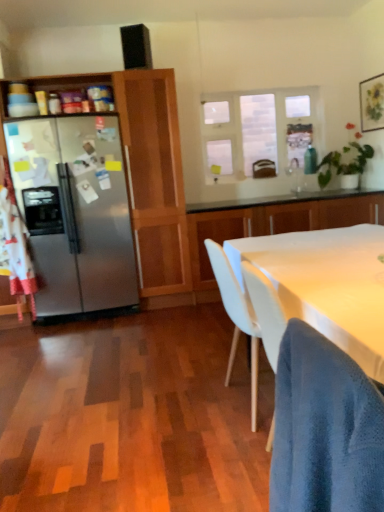
Describe the element at coordinates (274, 221) in the screenshot. This screenshot has width=384, height=512. I see `white glossy cabinet at center, positioned as the second cabinetry in left-to-right order` at that location.

The width and height of the screenshot is (384, 512). Describe the element at coordinates (136, 47) in the screenshot. I see `black matte speaker at upper center` at that location.

Based on the photo, measure the distance between satin silver refrigerator at left, marked as the 2th cabinetry in a right-to-left arrangement, and camera.

satin silver refrigerator at left, marked as the 2th cabinetry in a right-to-left arrangement, and camera are 3.49 meters apart from each other.

The width and height of the screenshot is (384, 512). What are the coordinates of `satin silver refrigerator at left, positioned as the 1th cabinetry in left-to-right order` in the screenshot? It's located at [148, 172].

What do you see at coordinates (325, 429) in the screenshot?
I see `blue textured fabric chair at lower right` at bounding box center [325, 429].

Describe the element at coordinates (344, 164) in the screenshot. I see `green leafy plant at upper right` at that location.

I want to click on white glossy cabinet at center, positioned as the second cabinetry in left-to-right order, so click(x=274, y=221).

How many degrees apart are the facing directions of blue textured fabric chair at lower right and green leafy plant at upper right?

The angular difference between blue textured fabric chair at lower right and green leafy plant at upper right is 88.8 degrees.

How much distance is there between blue textured fabric chair at lower right and green leafy plant at upper right?

The distance of blue textured fabric chair at lower right from green leafy plant at upper right is 13.07 feet.

Does blue textured fabric chair at lower right appear on the right side of green leafy plant at upper right?

In fact, blue textured fabric chair at lower right is to the left of green leafy plant at upper right.

Looking at this image, is blue textured fabric chair at lower right further to camera compared to green leafy plant at upper right?

No.

Based on the photo, is clear glass window at upper center further to camera compared to green leafy plant at upper right?

Yes, clear glass window at upper center is further from the camera.

From a real-world perspective, which is physically below, clear glass window at upper center or green leafy plant at upper right?

green leafy plant at upper right is physically lower.

From their relative heights in the image, would you say clear glass window at upper center is taller or shorter than green leafy plant at upper right?

Considering their sizes, clear glass window at upper center has more height than green leafy plant at upper right.

Which object is wider, white glossy cabinet at center, arranged as the first cabinetry when viewed from the right, or blue textured fabric chair at lower right?

white glossy cabinet at center, arranged as the first cabinetry when viewed from the right.

In terms of size, does white glossy cabinet at center, arranged as the first cabinetry when viewed from the right, appear bigger or smaller than blue textured fabric chair at lower right?

white glossy cabinet at center, arranged as the first cabinetry when viewed from the right, is bigger than blue textured fabric chair at lower right.

Consider the image. Which object is closer to the camera taking this photo, white glossy cabinet at center, positioned as the second cabinetry in left-to-right order, or blue textured fabric chair at lower right?

blue textured fabric chair at lower right is closer to the camera.

Is clear glass window at upper center to the left of blue textured fabric chair at lower right from the viewer's perspective?

Incorrect, clear glass window at upper center is not on the left side of blue textured fabric chair at lower right.

Is the position of clear glass window at upper center more distant than that of blue textured fabric chair at lower right?

Yes, clear glass window at upper center is further from the viewer.

Considering the relative sizes of clear glass window at upper center and blue textured fabric chair at lower right in the image provided, is clear glass window at upper center shorter than blue textured fabric chair at lower right?

No, clear glass window at upper center is not shorter than blue textured fabric chair at lower right.

From the image's perspective, which one is positioned lower, clear glass window at upper center or blue textured fabric chair at lower right?

From the image's view, blue textured fabric chair at lower right is below.

From the image's perspective, between satin silver refrigerator at left, positioned as the 1th cabinetry in left-to-right order, and clear glass window at upper center, who is located below?

satin silver refrigerator at left, positioned as the 1th cabinetry in left-to-right order, appears lower in the image.

Where is `window lying behind the satin silver refrigerator at left, marked as the 2th cabinetry in a right-to-left arrangement`? window lying behind the satin silver refrigerator at left, marked as the 2th cabinetry in a right-to-left arrangement is located at coordinates (257, 130).

Based on the photo, considering the sizes of satin silver refrigerator at left, marked as the 2th cabinetry in a right-to-left arrangement, and clear glass window at upper center in the image, is satin silver refrigerator at left, marked as the 2th cabinetry in a right-to-left arrangement, wider or thinner than clear glass window at upper center?

satin silver refrigerator at left, marked as the 2th cabinetry in a right-to-left arrangement, is wider than clear glass window at upper center.

Is green leafy plant at upper right looking in the opposite direction of clear glass window at upper center?

No.

From a real-world perspective, between green leafy plant at upper right and clear glass window at upper center, who is vertically higher?

clear glass window at upper center is physically above.

Is green leafy plant at upper right in front of clear glass window at upper center?

Yes, green leafy plant at upper right is in front of clear glass window at upper center.

Which is more to the left, green leafy plant at upper right or clear glass window at upper center?

Positioned to the left is clear glass window at upper center.

Considering the sizes of objects satin silver refrigerator at left, positioned as the 1th cabinetry in left-to-right order, and white matte table at center in the image provided, who is thinner, satin silver refrigerator at left, positioned as the 1th cabinetry in left-to-right order, or white matte table at center?

satin silver refrigerator at left, positioned as the 1th cabinetry in left-to-right order, is thinner.

From a real-world perspective, count 2nd cabinetrys upward from the white matte table at center and point to it. Please provide its 2D coordinates.

[(148, 172)]

Can white matte table at center be found inside satin silver refrigerator at left, marked as the 2th cabinetry in a right-to-left arrangement?

No, white matte table at center is not inside satin silver refrigerator at left, marked as the 2th cabinetry in a right-to-left arrangement.

Considering the positions of points (157, 261) and (333, 248), is point (157, 261) farther from camera compared to point (333, 248)?

Yes, point (157, 261) is farther from viewer.

Where is `houseplant lying above the blue textured fabric chair at lower right (from the image's perspective)`? The image size is (384, 512). houseplant lying above the blue textured fabric chair at lower right (from the image's perspective) is located at coordinates (344, 164).

You are a GUI agent. You are given a task and a screenshot of the screen. Output one action in this format:
    pyautogui.click(x=<x>, y=<y>)
    Task: Click on the window on the left of green leafy plant at upper right
    Image resolution: width=384 pixels, height=512 pixels.
    Given the screenshot: What is the action you would take?
    257,130

Looking at the image, which one is located further to satin silver refrigerator at left, positioned as the 1th cabinetry in left-to-right order, white matte table at center or green leafy plant at upper right?

green leafy plant at upper right is further to satin silver refrigerator at left, positioned as the 1th cabinetry in left-to-right order.

Estimate the real-world distances between objects in this image. Which object is further from black matte speaker at upper center, blue textured fabric chair at lower right or satin silver refrigerator at left, marked as the 2th cabinetry in a right-to-left arrangement?

Based on the image, blue textured fabric chair at lower right appears to be further to black matte speaker at upper center.

Based on the photo, estimate the real-world distances between objects in this image. Which object is further from black matte speaker at upper center, green leafy plant at upper right or blue textured fabric chair at lower right?

Based on the image, blue textured fabric chair at lower right appears to be further to black matte speaker at upper center.

Based on their spatial positions, is clear glass window at upper center or blue textured fabric chair at lower right closer to white glossy cabinet at center, arranged as the first cabinetry when viewed from the right?

clear glass window at upper center is positioned closer to the anchor white glossy cabinet at center, arranged as the first cabinetry when viewed from the right.

Which object lies nearer to the anchor point clear glass window at upper center, satin silver refrigerator at left, marked as the 2th cabinetry in a right-to-left arrangement, or white matte table at center?

The object closer to clear glass window at upper center is satin silver refrigerator at left, marked as the 2th cabinetry in a right-to-left arrangement.

Based on their spatial positions, is satin silver refrigerator at left, positioned as the 1th cabinetry in left-to-right order, or green leafy plant at upper right closer to clear glass window at upper center?

green leafy plant at upper right is closer to clear glass window at upper center.

When comparing their distances from satin silver refrigerator at left, positioned as the 1th cabinetry in left-to-right order, does clear glass window at upper center or green leafy plant at upper right seem closer?

clear glass window at upper center is closer to satin silver refrigerator at left, positioned as the 1th cabinetry in left-to-right order.

Looking at the image, which one is located closer to satin silver refrigerator at left, positioned as the 1th cabinetry in left-to-right order, blue textured fabric chair at lower right or green leafy plant at upper right?

green leafy plant at upper right is positioned closer to the anchor satin silver refrigerator at left, positioned as the 1th cabinetry in left-to-right order.

The image size is (384, 512). Identify the location of cabinetry between blue textured fabric chair at lower right and white glossy cabinet at center, arranged as the first cabinetry when viewed from the right, along the z-axis. (148, 172).

Locate an element on the screen. The image size is (384, 512). houseplant between clear glass window at upper center and white glossy cabinet at center, positioned as the second cabinetry in left-to-right order, in the up-down direction is located at coordinates (344, 164).

Locate an element on the screen. houseplant between white matte table at center and clear glass window at upper center in the front-back direction is located at coordinates (344, 164).

Identify the location of window between satin silver refrigerator at left, positioned as the 1th cabinetry in left-to-right order, and green leafy plant at upper right from left to right. The width and height of the screenshot is (384, 512). (257, 130).